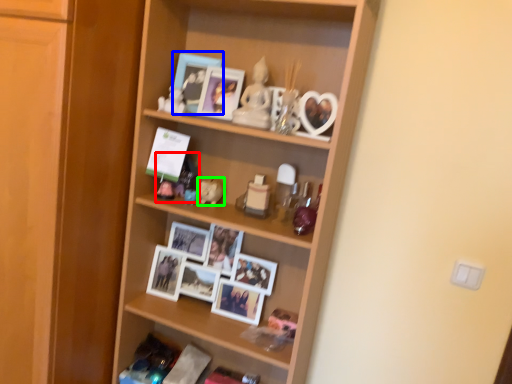
Question: Based on their relative distances, which object is farther from toy (highlighted by a red box)? Choose from picture frame (highlighted by a blue box) and toy (highlighted by a green box).

Choices:
 (A) picture frame
 (B) toy

Answer: (A)